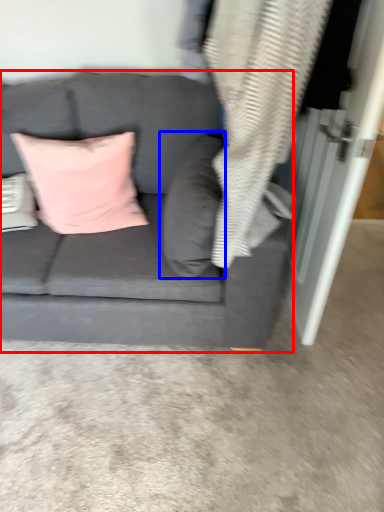
Question: Which object appears closest to the camera in this image, studio couch (highlighted by a red box) or pillow (highlighted by a blue box)?

Choices:
 (A) studio couch
 (B) pillow

Answer: (A)